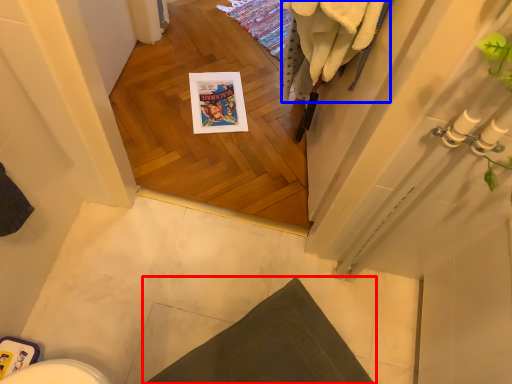
Question: Which of the following is the farthest to the observer, bath mat (highlighted by a red box) or bath towel (highlighted by a blue box)?

Choices:
 (A) bath mat
 (B) bath towel

Answer: (A)